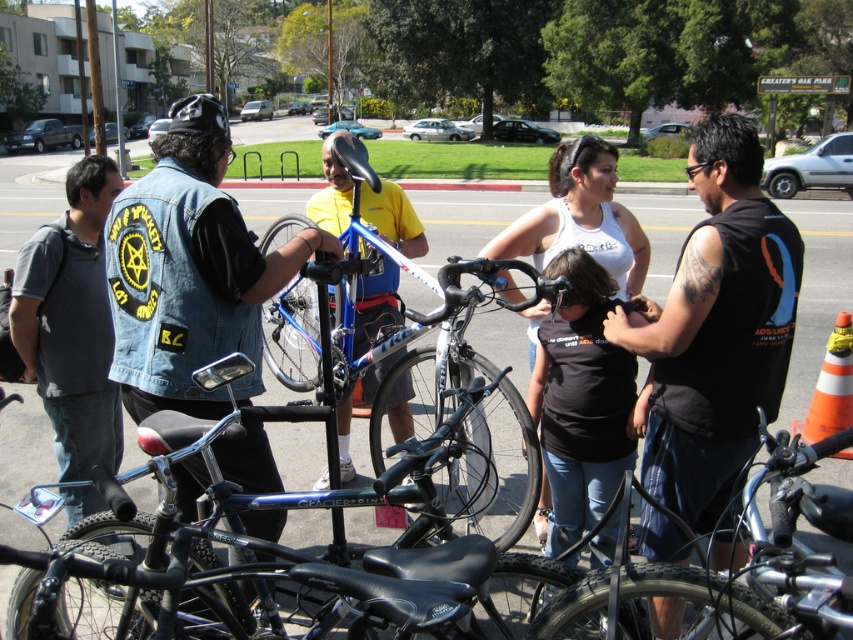
You are standing in the parking lot and want to locate two specific points in the image. The first point, point (103, 547), and the second point, point (341, 424). Which point is closer to you?

Point (103, 547) is closer to you than point (341, 424).

You are standing in the parking lot and see the denim vest at center and the shiny black bike at center. Which object is positioned to the right?

The shiny black bike at center is positioned to the right of the denim vest at center.

You are a cyclist trying to locate your shiny black bike at center in the parking lot. There are several bikes around. How can the denim vest at center help you find your bike?

The denim vest at center is positioned over the shiny black bike at center, so look for the bike with the denim vest placed directly on top of it.